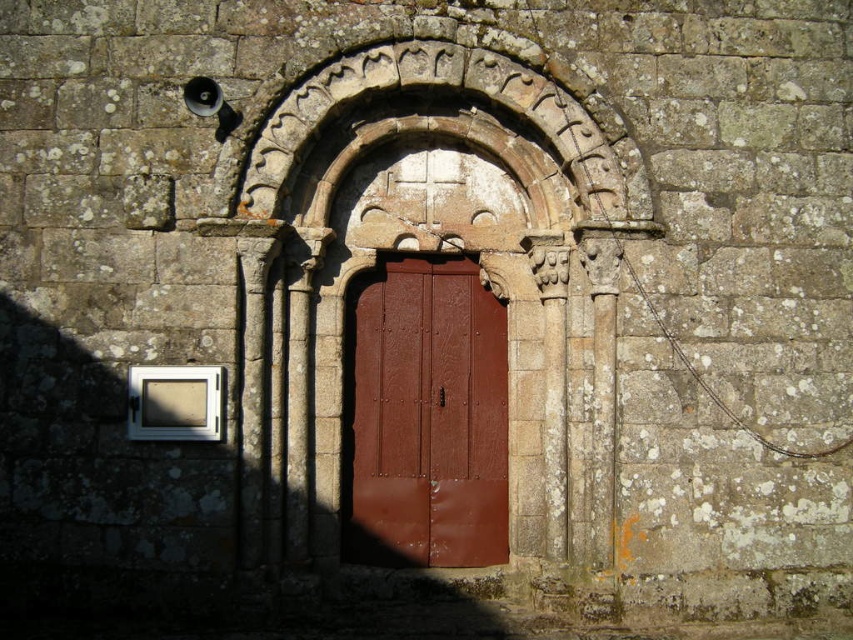
Does stone carved archway at center appear on the left side of matte brown wooden door at center?

No, stone carved archway at center is not to the left of matte brown wooden door at center.

Consider the image. Who is higher up, stone carved archway at center or matte brown wooden door at center?

Positioned higher is stone carved archway at center.

Is point (635, 225) positioned in front of point (386, 396)?

Yes, it is in front of point (386, 396).

Find the location of `stone carved archway at center`. stone carved archway at center is located at coordinates (430, 301).